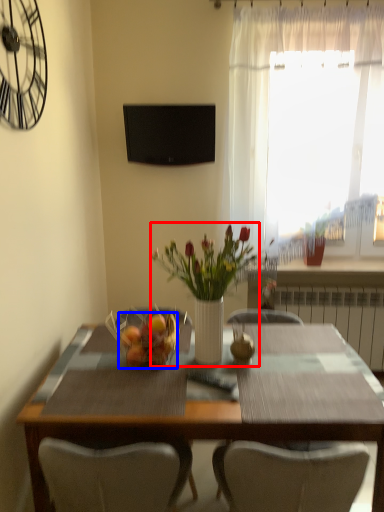
Question: Which object is further to the camera taking this photo, floral arrangement (highlighted by a red box) or fruit dish (highlighted by a blue box)?

Choices:
 (A) floral arrangement
 (B) fruit dish

Answer: (B)